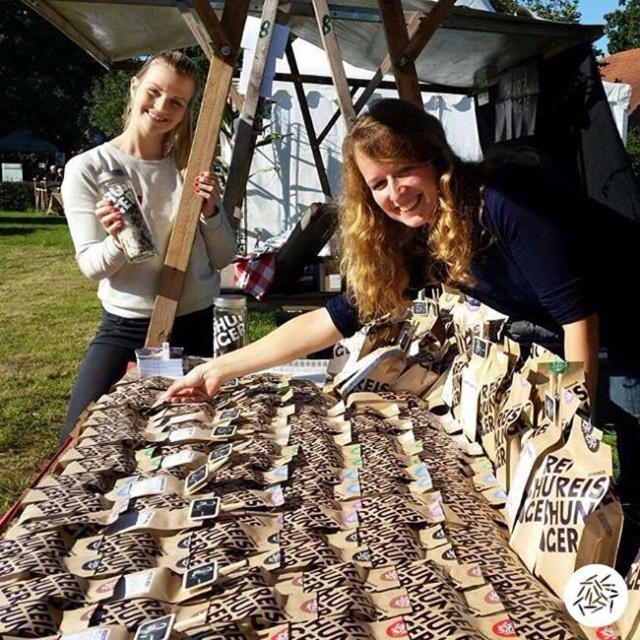
Question: Among these points, which one is farthest from the camera?

Choices:
 (A) (588, 348)
 (B) (113, 342)

Answer: (B)

Question: Based on their relative distances, which object is farther from the brown paper bags at center?

Choices:
 (A) brown paper bag at center
 (B) matte white sweater at upper left

Answer: (B)

Question: Estimate the real-world distances between objects in this image. Which object is farther from the brown paper bag at center?

Choices:
 (A) matte white sweater at upper left
 (B) brown paper bags at center

Answer: (A)

Question: Does matte white sweater at upper left appear on the right side of brown paper bag at center?

Choices:
 (A) no
 (B) yes

Answer: (A)

Question: Does matte white sweater at upper left lie behind brown paper bag at center?

Choices:
 (A) no
 (B) yes

Answer: (B)

Question: Does brown paper bags at center come behind brown paper bag at center?

Choices:
 (A) no
 (B) yes

Answer: (A)